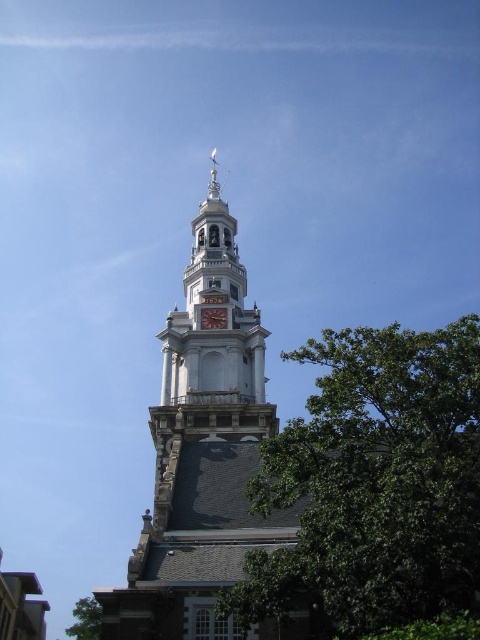
You are standing at the point marked by the coordinates [202,452] in the image. Based on the scene description, what architectural feature are you most likely standing at?

You are most likely standing at the stone clock tower at center, as the coordinates point [202,452] represent this feature.